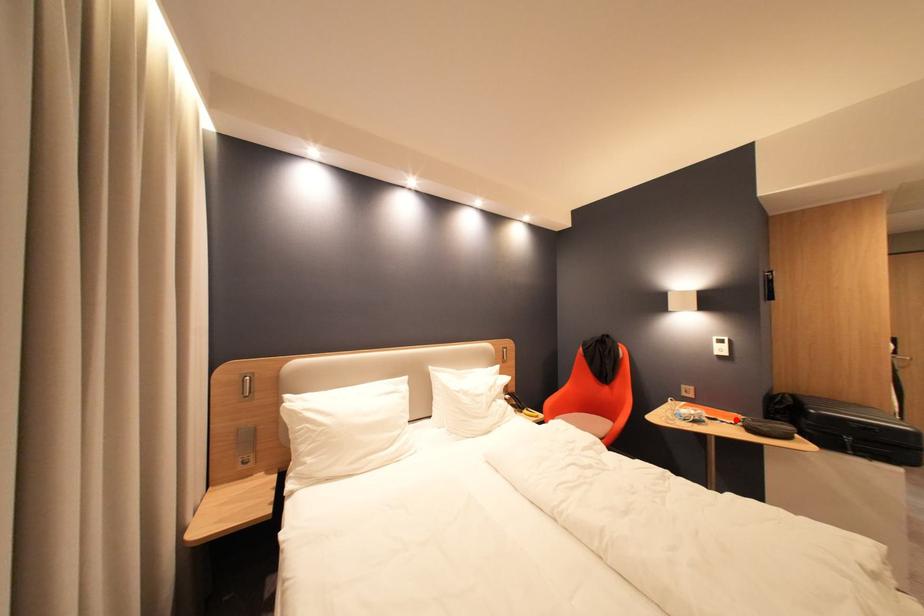
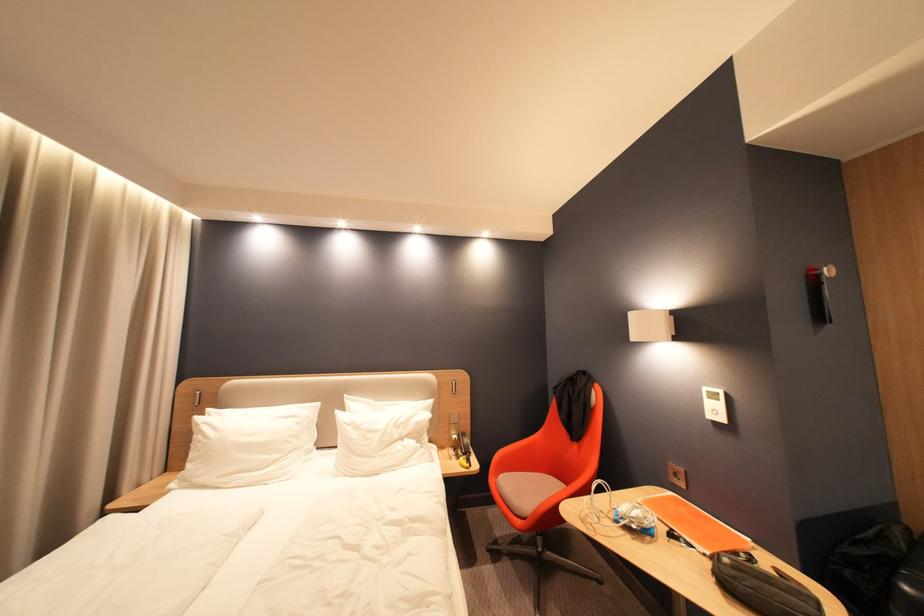
In the second image, find the point that corresponds to the highlighted location in the first image.

(710, 544)